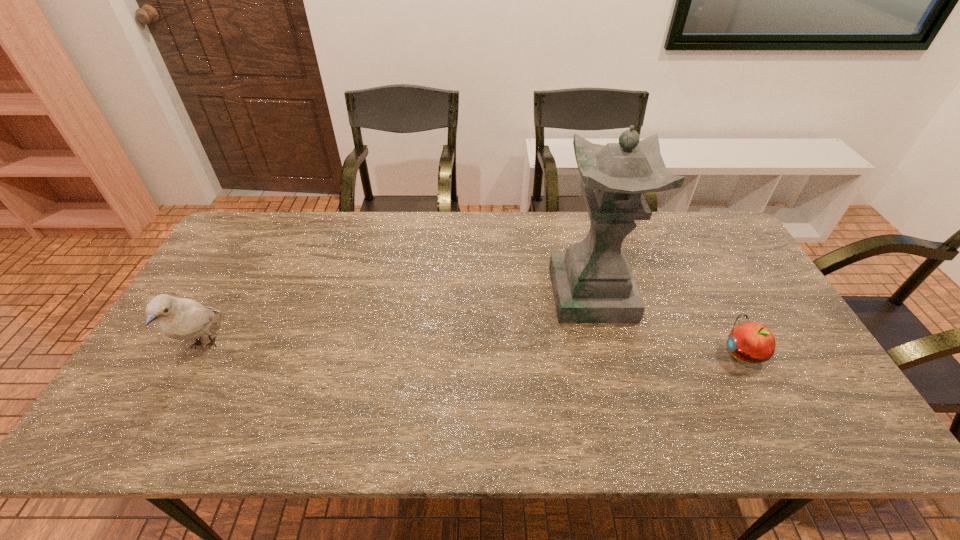
Locate which object ranks in proximity to the rightmost object. Please provide its 2D coordinates. Your answer should be formatted as a tuple, i.e. [(x, y)], where the tuple contains the x and y coordinates of a point satisfying the conditions above.

[(592, 282)]

You are a GUI agent. You are given a task and a screenshot of the screen. Output one action in this format:
    pyautogui.click(x=<x>, y=<y>)
    Task: Click on the free spot that satisfies the following two spatial constraints: 1. at the front opening of the sculpture; 2. on the left side of the apple
    Image resolution: width=960 pixels, height=540 pixels.
    Given the screenshot: What is the action you would take?
    pyautogui.click(x=607, y=354)

This screenshot has width=960, height=540. In order to click on vacant position in the image that satisfies the following two spatial constraints: 1. at the beak of the bird; 2. on the right side of the apple in this screenshot , I will do `click(200, 354)`.

I want to click on free spot that satisfies the following two spatial constraints: 1. at the front opening of the apple; 2. on the right side of the sculpture, so click(x=607, y=354).

Where is `free location that satisfies the following two spatial constraints: 1. at the front opening of the tallest object; 2. on the right side of the rightmost object`? This screenshot has width=960, height=540. free location that satisfies the following two spatial constraints: 1. at the front opening of the tallest object; 2. on the right side of the rightmost object is located at coordinates (607, 354).

Locate an element on the screen. The width and height of the screenshot is (960, 540). vacant space that satisfies the following two spatial constraints: 1. at the front opening of the sculpture; 2. at the beak of the bird is located at coordinates point(605,345).

The height and width of the screenshot is (540, 960). I want to click on blank space that satisfies the following two spatial constraints: 1. at the front opening of the apple; 2. on the right side of the sculpture, so click(x=607, y=354).

Find the location of a particular element. The width and height of the screenshot is (960, 540). free space that satisfies the following two spatial constraints: 1. at the front opening of the sculpture; 2. at the beak of the leftmost object is located at coordinates (605, 345).

You are a GUI agent. You are given a task and a screenshot of the screen. Output one action in this format:
    pyautogui.click(x=<x>, y=<y>)
    Task: Click on the vacant position in the image that satisfies the following two spatial constraints: 1. at the front opening of the tallest object; 2. on the right side of the rightmost object
    This screenshot has width=960, height=540.
    Given the screenshot: What is the action you would take?
    pyautogui.click(x=607, y=354)

Find the location of a particular element. Image resolution: width=960 pixels, height=540 pixels. free space in the image that satisfies the following two spatial constraints: 1. on the back side of the shortest object; 2. at the front opening of the second object from right to left is located at coordinates (711, 294).